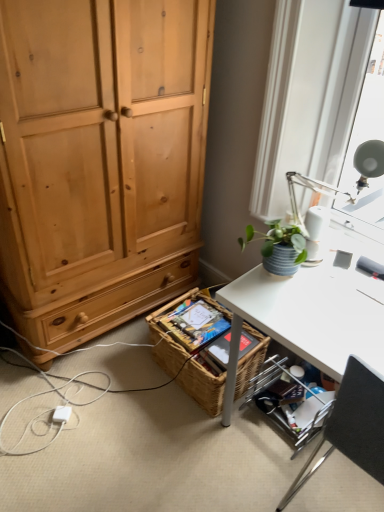
Question: Is black fabric chair at lower right taller than metallic silver shelf at lower right?

Choices:
 (A) yes
 (B) no

Answer: (A)

Question: Considering the relative sizes of black fabric chair at lower right and metallic silver shelf at lower right in the image provided, is black fabric chair at lower right thinner than metallic silver shelf at lower right?

Choices:
 (A) no
 (B) yes

Answer: (A)

Question: Is black fabric chair at lower right far from metallic silver shelf at lower right?

Choices:
 (A) yes
 (B) no

Answer: (B)

Question: Is black fabric chair at lower right directly adjacent to metallic silver shelf at lower right?

Choices:
 (A) no
 (B) yes

Answer: (A)

Question: Would you say black fabric chair at lower right is outside metallic silver shelf at lower right?

Choices:
 (A) no
 (B) yes

Answer: (B)

Question: Does black fabric chair at lower right turn towards metallic silver shelf at lower right?

Choices:
 (A) yes
 (B) no

Answer: (B)

Question: Is metallic silver shelf at lower right smaller than white plastic power outlet at lower left?

Choices:
 (A) yes
 (B) no

Answer: (B)

Question: Is metallic silver shelf at lower right at the right side of white plastic power outlet at lower left?

Choices:
 (A) no
 (B) yes

Answer: (B)

Question: Is metallic silver shelf at lower right taller than white plastic power outlet at lower left?

Choices:
 (A) no
 (B) yes

Answer: (B)

Question: From the image's perspective, is metallic silver shelf at lower right under white plastic power outlet at lower left?

Choices:
 (A) yes
 (B) no

Answer: (B)

Question: From a real-world perspective, is metallic silver shelf at lower right below white plastic power outlet at lower left?

Choices:
 (A) no
 (B) yes

Answer: (A)

Question: Are metallic silver shelf at lower right and white plastic power outlet at lower left beside each other?

Choices:
 (A) no
 (B) yes

Answer: (A)

Question: Are white plastic power outlet at lower left and metallic silver shelf at lower right beside each other?

Choices:
 (A) no
 (B) yes

Answer: (A)